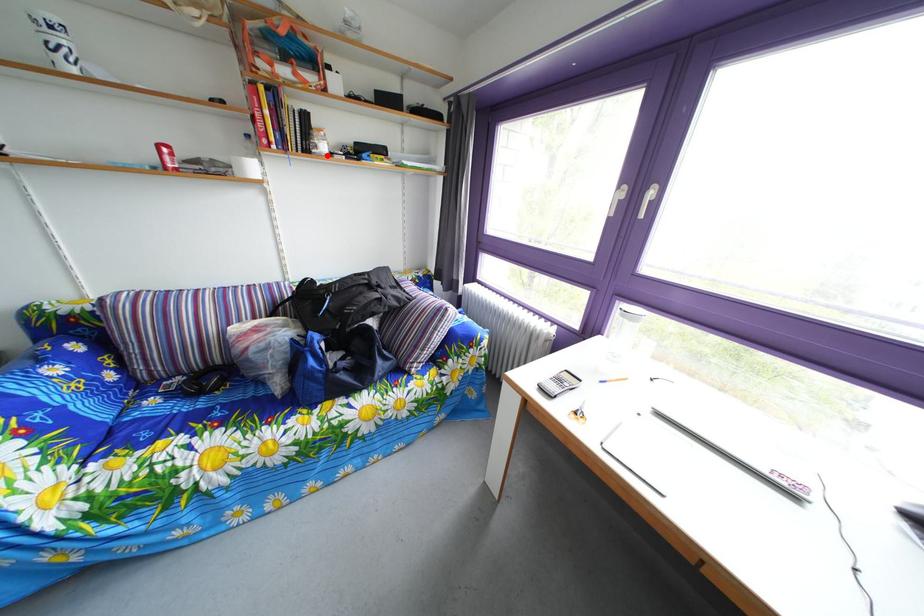
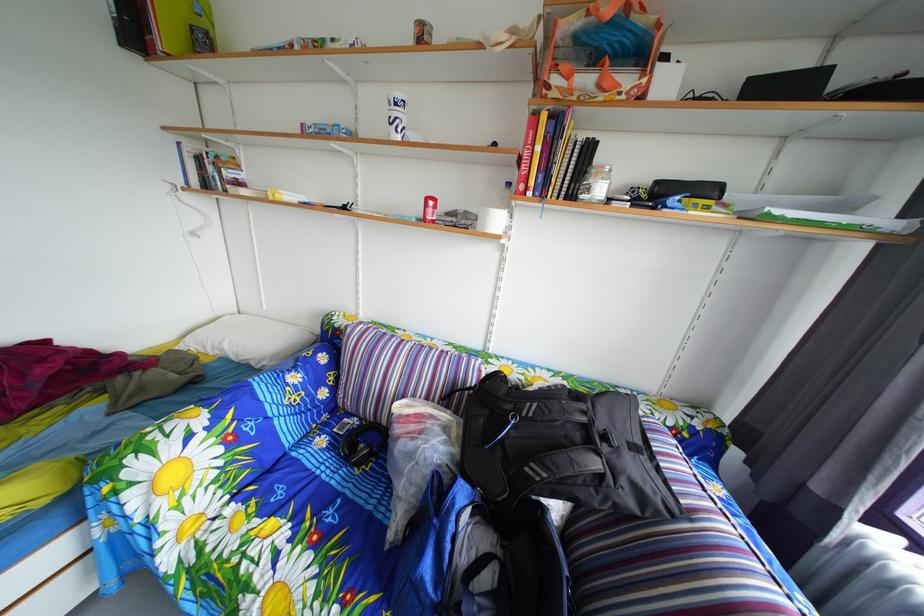
The point at the highlighted location is marked in the first image. Where is the corresponding point in the second image?

(600, 198)